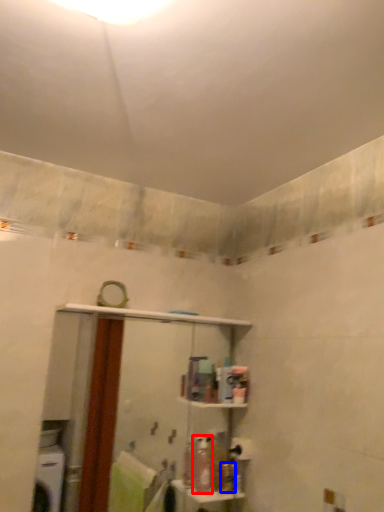
Question: Which object is closer to the camera taking this photo, toiletry (highlighted by a red box) or toiletry (highlighted by a blue box)?

Choices:
 (A) toiletry
 (B) toiletry

Answer: (A)